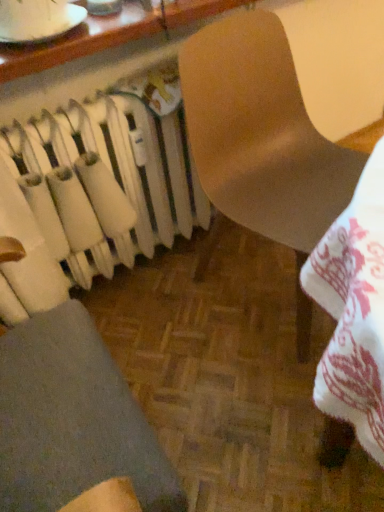
Question: Is matte brown chair at center at the back of white matte radiator at left?

Choices:
 (A) yes
 (B) no

Answer: (B)

Question: Is white matte radiator at left at the right side of matte brown chair at center?

Choices:
 (A) no
 (B) yes

Answer: (A)

Question: Can we say white matte radiator at left lies outside matte brown chair at center?

Choices:
 (A) yes
 (B) no

Answer: (A)

Question: Considering the relative sizes of white matte radiator at left and matte brown chair at center in the image provided, is white matte radiator at left shorter than matte brown chair at center?

Choices:
 (A) yes
 (B) no

Answer: (A)

Question: Is white matte radiator at left aimed at matte brown chair at center?

Choices:
 (A) no
 (B) yes

Answer: (A)

Question: Considering the positions of matte wooden table at upper center and matte brown chair at center in the image, is matte wooden table at upper center taller or shorter than matte brown chair at center?

Choices:
 (A) short
 (B) tall

Answer: (A)

Question: In terms of size, does matte wooden table at upper center appear bigger or smaller than matte brown chair at center?

Choices:
 (A) big
 (B) small

Answer: (B)

Question: Relative to matte brown chair at center, is matte wooden table at upper center in front or behind?

Choices:
 (A) behind
 (B) front

Answer: (A)

Question: Is matte wooden table at upper center wider or thinner than matte brown chair at center?

Choices:
 (A) thin
 (B) wide

Answer: (A)

Question: Considering the positions of matte brown chair at center and matte wooden table at upper center in the image, is matte brown chair at center taller or shorter than matte wooden table at upper center?

Choices:
 (A) tall
 (B) short

Answer: (A)

Question: Relative to matte wooden table at upper center, is matte brown chair at center in front or behind?

Choices:
 (A) front
 (B) behind

Answer: (A)

Question: Visually, is matte brown chair at center positioned to the left or to the right of matte wooden table at upper center?

Choices:
 (A) right
 (B) left

Answer: (A)

Question: Considering the positions of matte brown chair at center and matte wooden table at upper center in the image, is matte brown chair at center wider or thinner than matte wooden table at upper center?

Choices:
 (A) wide
 (B) thin

Answer: (A)

Question: Is white matte radiator at left inside the boundaries of matte wooden table at upper center, or outside?

Choices:
 (A) outside
 (B) inside

Answer: (A)

Question: From the image's perspective, is white matte radiator at left above or below matte wooden table at upper center?

Choices:
 (A) above
 (B) below

Answer: (B)